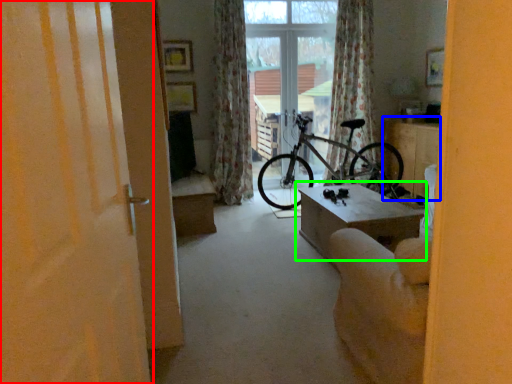
Question: Considering the real-world distances, which object is closest to door (highlighted by a red box)? table (highlighted by a blue box) or table (highlighted by a green box).

Choices:
 (A) table
 (B) table

Answer: (B)